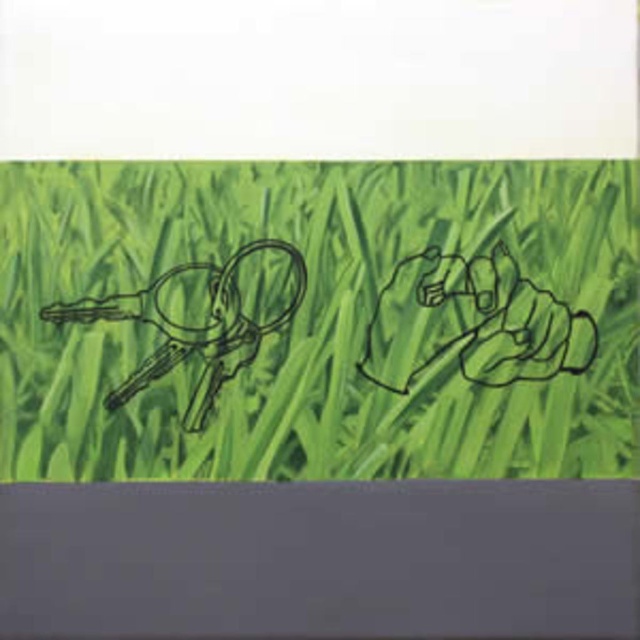
Is point (348, 272) farther from camera compared to point (250, 348)?

That is True.

Does point (42, 368) lie in front of point (173, 346)?

That is True.

I want to click on green grass at center, so click(x=317, y=320).